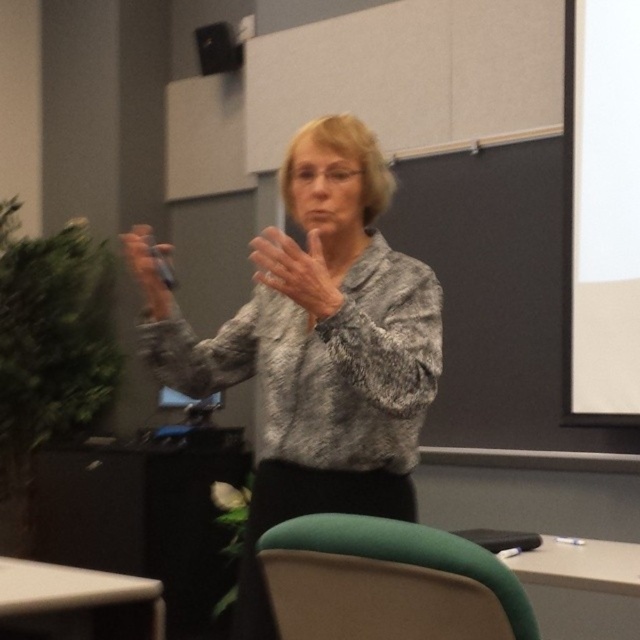
Between gray textured sweater at center and matte black speaker at upper center, which one appears on the left side from the viewer's perspective?

matte black speaker at upper center is more to the left.

Is point (310, 310) positioned in front of point (220, 49)?

Yes, point (310, 310) is in front of point (220, 49).

This screenshot has height=640, width=640. Find the location of `gray textured sweater at center`. gray textured sweater at center is located at coordinates (296, 272).

Who is taller, gray textured blouse at center or white matte projection screen at upper right?

white matte projection screen at upper right is taller.

Is point (250, 548) positioned in front of point (611, 141)?

Yes.

Locate an element on the screen. gray textured blouse at center is located at coordinates (323, 349).

Is white matte projection screen at upper right thinner than green fabric chair at lower center?

Yes.

Does white matte projection screen at upper right appear over green fabric chair at lower center?

Indeed, white matte projection screen at upper right is positioned over green fabric chair at lower center.

You are a GUI agent. You are given a task and a screenshot of the screen. Output one action in this format:
    pyautogui.click(x=<x>, y=<y>)
    Task: Click on the white matte projection screen at upper right
    
    Given the screenshot: What is the action you would take?
    pyautogui.click(x=602, y=209)

Locate an element on the screen. This screenshot has width=640, height=640. white matte projection screen at upper right is located at coordinates (602, 209).